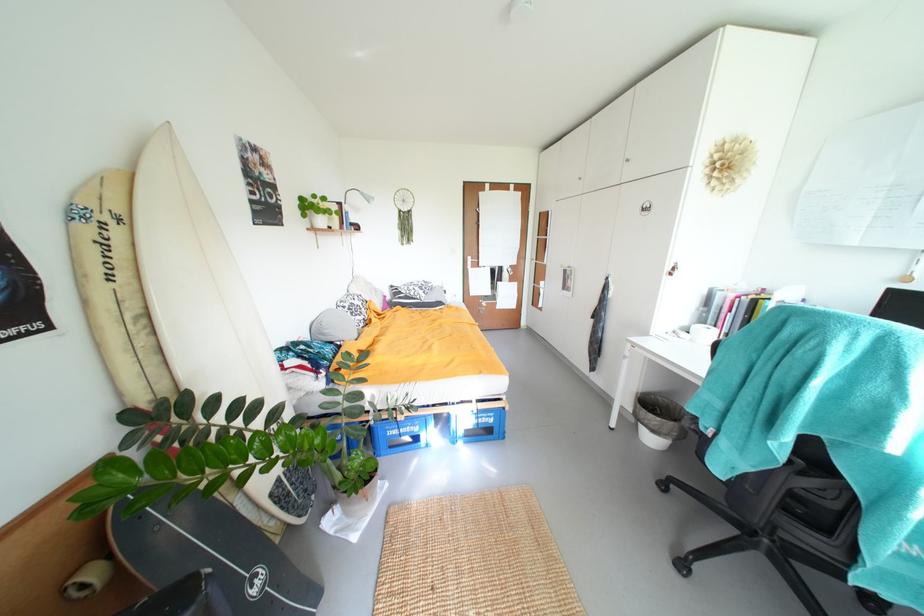
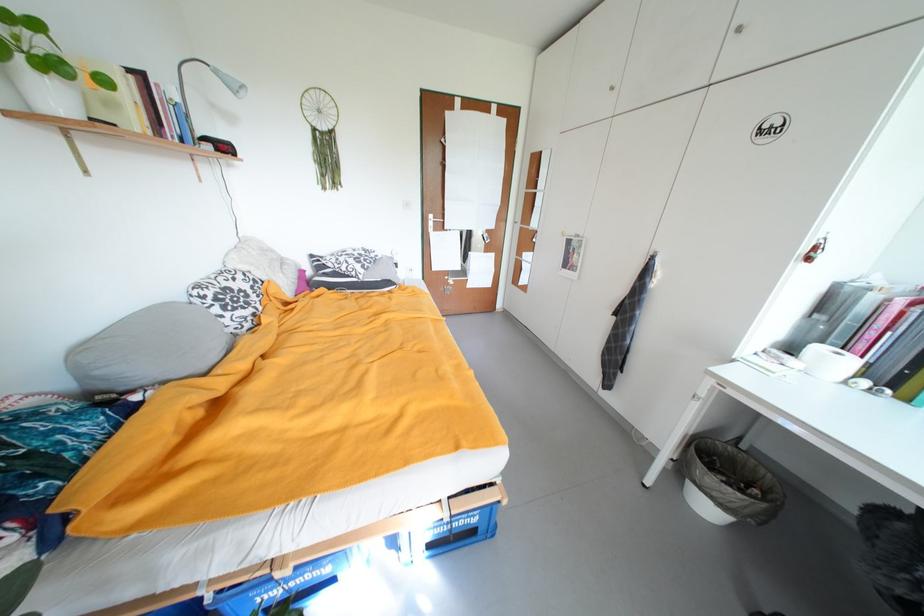
The point at (351, 309) is marked in the first image. Where is the corresponding point in the second image?

(211, 299)